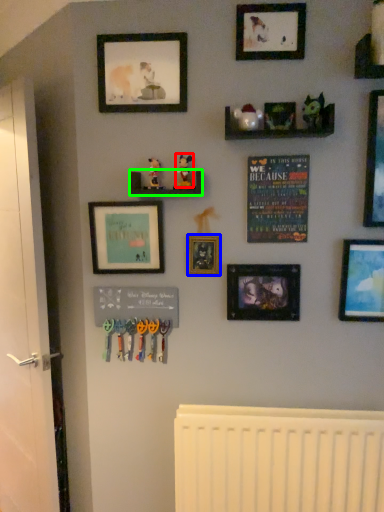
Question: Based on their relative distances, which object is farther from toy (highlighted by a red box)? Choose from picture frame (highlighted by a blue box) and shelf (highlighted by a green box).

Choices:
 (A) picture frame
 (B) shelf

Answer: (A)